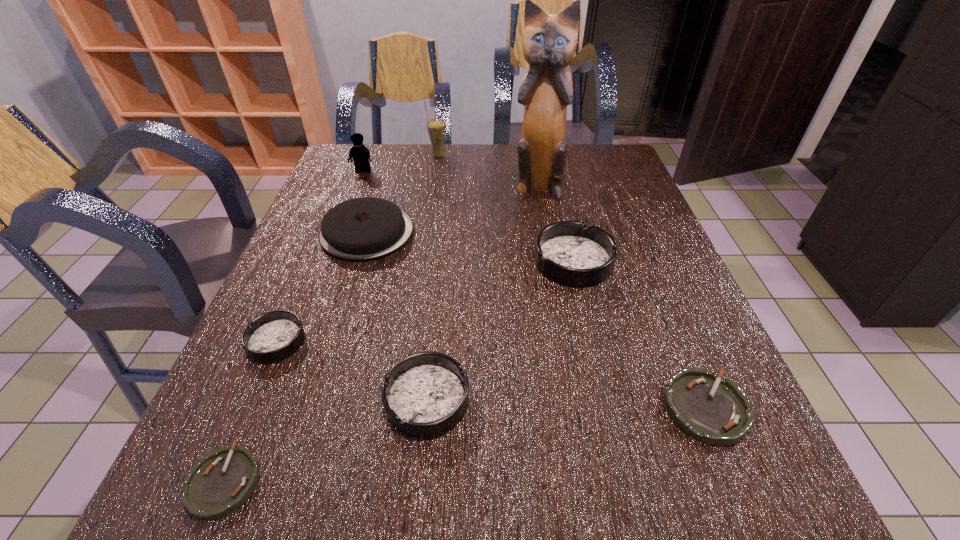
Point out which dark ashtray is positioned as the second nearest to the nearest dark ashtray. Please provide its 2D coordinates. Your answer should be formatted as a tuple, i.e. [(x, y)], where the tuple contains the x and y coordinates of a point satisfying the conditions above.

[(567, 252)]

Identify which dark ashtray is located as the nearest to the second tallest object. Please provide its 2D coordinates. Your answer should be formatted as a tuple, i.e. [(x, y)], where the tuple contains the x and y coordinates of a point satisfying the conditions above.

[(567, 252)]

The height and width of the screenshot is (540, 960). Identify the location of free space that satisfies the following two spatial constraints: 1. on the front-facing side of the Lego; 2. on the left side of the pancake. 340,232.

Where is `free space that satisfies the following two spatial constraints: 1. on the back side of the shortest object; 2. on the right side of the bigger green ashtray`? The image size is (960, 540). free space that satisfies the following two spatial constraints: 1. on the back side of the shortest object; 2. on the right side of the bigger green ashtray is located at coordinates (254, 408).

This screenshot has height=540, width=960. What are the coordinates of `vacant point that satisfies the following two spatial constraints: 1. on the front-facing side of the pancake; 2. on the right side of the yellow Lego` in the screenshot? It's located at (340, 232).

Where is `vacant space that satisfies the following two spatial constraints: 1. on the front side of the eighth tallest object; 2. on the left side of the second tallest ashtray`? The height and width of the screenshot is (540, 960). vacant space that satisfies the following two spatial constraints: 1. on the front side of the eighth tallest object; 2. on the left side of the second tallest ashtray is located at coordinates (426, 408).